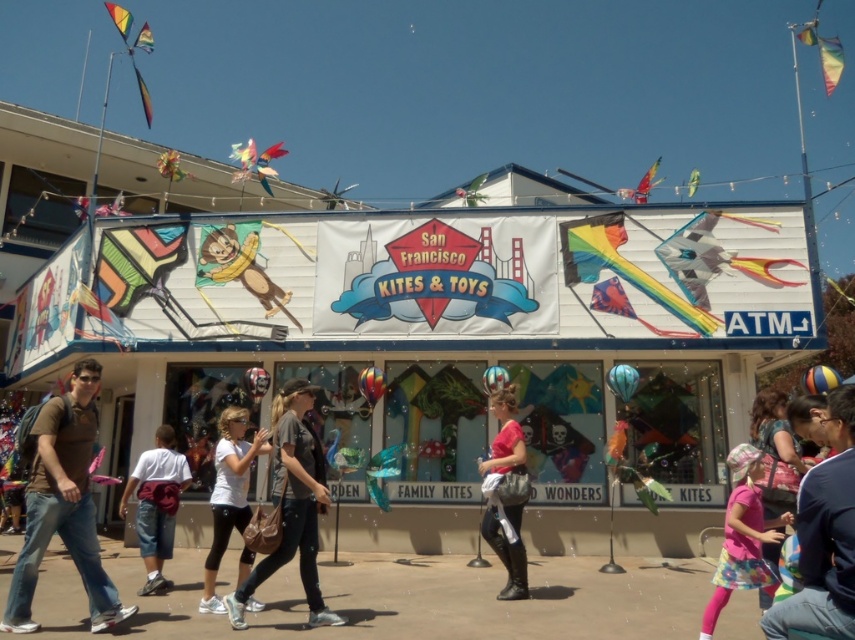
Who is taller, white cotton shirt at left or shiny metallic kite at upper center?

shiny metallic kite at upper center

Locate an element on the screen. The image size is (855, 640). white cotton shirt at left is located at coordinates (156, 502).

Between point (178, 456) and point (620, 188), which one is positioned behind?

Point (620, 188)

Locate an element on the screen. white cotton shirt at left is located at coordinates (156, 502).

Looking at this image, who is positioned more to the left, white matte shirt at center or multicolored fabric kite at upper center?

Positioned to the left is multicolored fabric kite at upper center.

Find the location of `white matte shirt at center`. white matte shirt at center is located at coordinates (228, 493).

This screenshot has width=855, height=640. Identify the location of white matte shirt at center. (228, 493).

Where is `white matte shirt at center`? The image size is (855, 640). white matte shirt at center is located at coordinates (228, 493).

Is point (506, 552) behind point (171, 426)?

No.

Who is taller, matte pink shirt at center or white cotton shirt at left?

matte pink shirt at center is taller.

The image size is (855, 640). What do you see at coordinates (506, 493) in the screenshot?
I see `matte pink shirt at center` at bounding box center [506, 493].

I want to click on matte pink shirt at center, so click(506, 493).